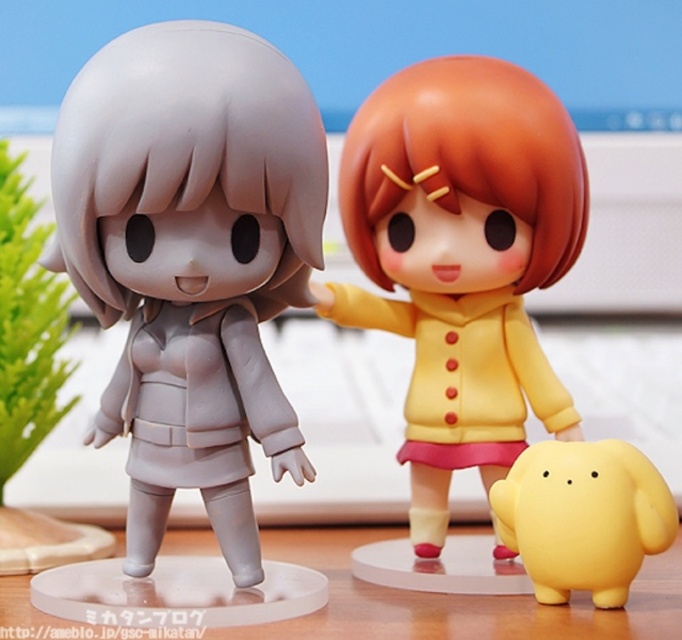
Is point (344, 172) in front of point (640, 506)?

That is False.

Which is more to the left, matte yellow plush at center or yellow matte plush at lower right?

Positioned to the left is matte yellow plush at center.

This screenshot has height=640, width=682. Find the location of `matte yellow plush at center`. matte yellow plush at center is located at coordinates (460, 259).

Does matte gray figurine at left have a greater height compared to matte yellow plush at center?

Incorrect, matte gray figurine at left's height is not larger of matte yellow plush at center's.

Who is more forward, [125,144] or [490,61]?

Point [125,144] is in front.

Is point (224, 273) positioned before point (357, 253)?

Yes, it is in front of point (357, 253).

I want to click on matte gray figurine at left, so click(192, 257).

Does matte yellow plush at center appear over transparent plastic table at center?

Indeed, matte yellow plush at center is positioned over transparent plastic table at center.

Where is `matte yellow plush at center`? This screenshot has width=682, height=640. matte yellow plush at center is located at coordinates (460, 259).

Where is `matte yellow plush at center`? Image resolution: width=682 pixels, height=640 pixels. matte yellow plush at center is located at coordinates (460, 259).

Find the location of `matte yellow plush at center`. matte yellow plush at center is located at coordinates (460, 259).